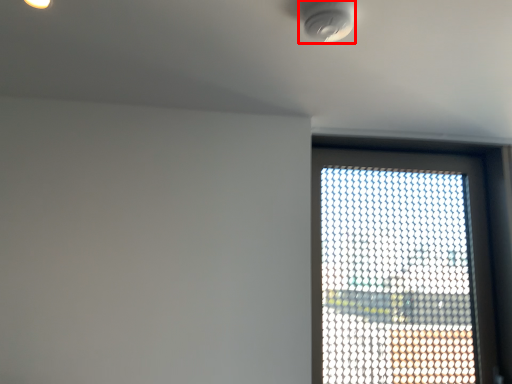
Question: From the image's perspective, where is light fixture (annotated by the red box) located in relation to window in the image?

Choices:
 (A) above
 (B) below

Answer: (A)